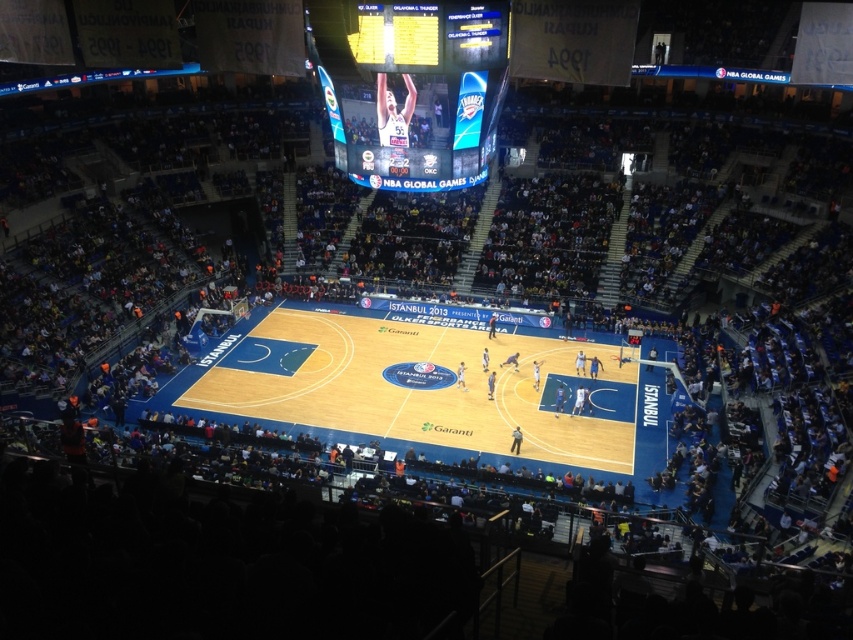
You are a photographer standing at the edge of the court. You want to take a photo that includes both the wooden at center and the matte plastic scoreboard at upper center. Which object should you position closer to the camera to ensure both are in focus?

The wooden at center is much taller than the matte plastic scoreboard at upper center. To ensure both are in focus, position the wooden at center closer to the camera since its larger size will require it to be nearer for proper framing while maintaining depth of field for the scoreboard in the background.

You are a photographer in the arena and want to capture a photo that includes both the shiny digital display at center and the matte plastic scoreboard at upper center. Which object should you focus on first if you want to ensure both are in focus, considering their sizes?

The shiny digital display at center is taller than the matte plastic scoreboard at upper center. To ensure both are in focus, focus on the shiny digital display at center since it is larger and requires more attention to detail.